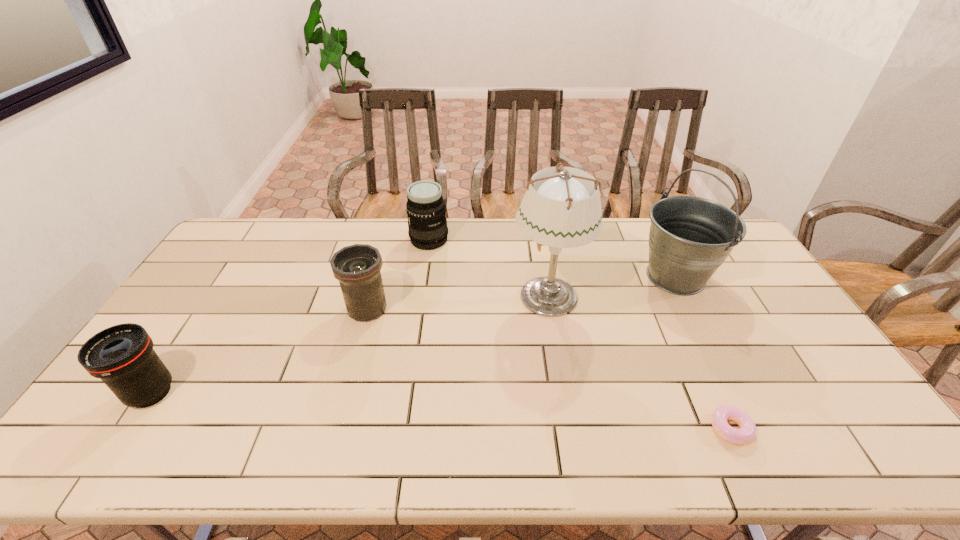
You are a GUI agent. You are given a task and a screenshot of the screen. Output one action in this format:
    pyautogui.click(x=<x>, y=<y>)
    Task: Click on the free space that satisfies the following two spatial constraints: 1. on the front side of the rightmost telephoto lens; 2. on the left side of the doughnut
    The width and height of the screenshot is (960, 540).
    Given the screenshot: What is the action you would take?
    pyautogui.click(x=401, y=428)

Locate an element on the screen. free space that satisfies the following two spatial constraints: 1. on the front side of the fifth shortest object; 2. on the lampshade of the lampshade is located at coordinates (685, 295).

Find the location of `vacant space that satisfies the following two spatial constraints: 1. on the back side of the leftmost telephoto lens; 2. on the left side of the fifth shortest object`. vacant space that satisfies the following two spatial constraints: 1. on the back side of the leftmost telephoto lens; 2. on the left side of the fifth shortest object is located at coordinates (228, 276).

This screenshot has width=960, height=540. Find the location of `vacant space that satisfies the following two spatial constraints: 1. on the lampshade of the third object from right to left; 2. on the left side of the shortest object`. vacant space that satisfies the following two spatial constraints: 1. on the lampshade of the third object from right to left; 2. on the left side of the shortest object is located at coordinates (571, 428).

Identify the location of free space that satisfies the following two spatial constraints: 1. on the back side of the shortest object; 2. on the left side of the fifth shortest object. (660, 276).